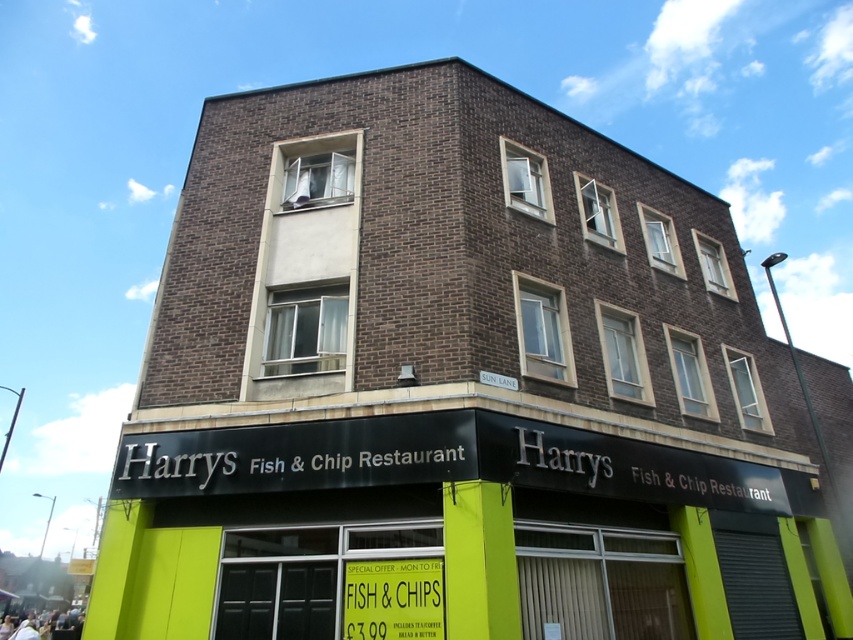
Is the position of green matte signboard at lower center less distant than that of yellow paper sign at lower center?

Yes.

Who is positioned more to the right, green matte signboard at lower center or yellow paper sign at lower center?

green matte signboard at lower center is more to the right.

Is point (297, 472) closer to viewer compared to point (373, 580)?

No, (297, 472) is further to viewer.

This screenshot has height=640, width=853. Identify the location of green matte signboard at lower center. (456, 525).